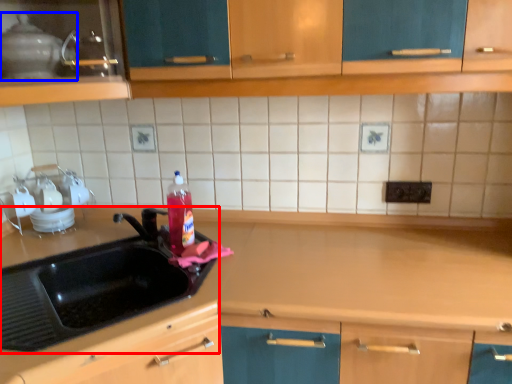
Question: Which object appears closest to the camera in this image, sink (highlighted by a red box) or appliance (highlighted by a blue box)?

Choices:
 (A) sink
 (B) appliance

Answer: (A)